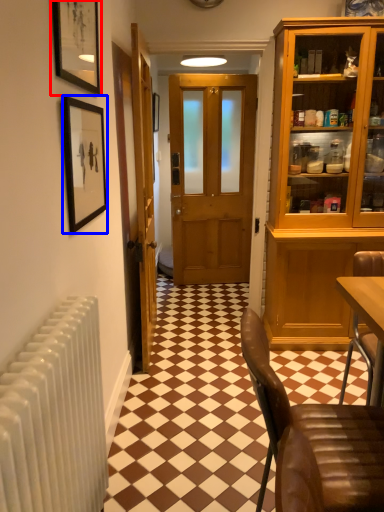
Question: Among these objects, which one is nearest to the camera, picture frame (highlighted by a red box) or picture frame (highlighted by a blue box)?

Choices:
 (A) picture frame
 (B) picture frame

Answer: (A)